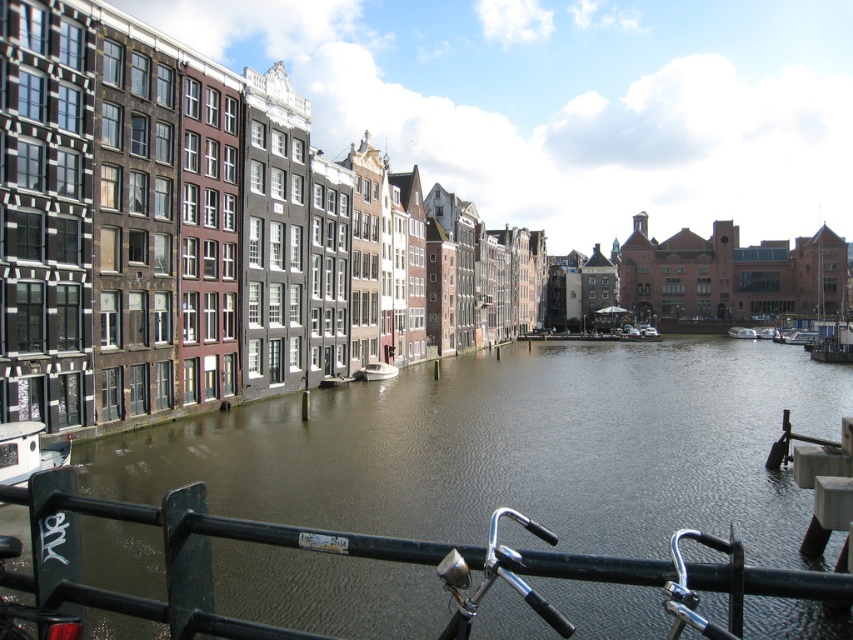
Which of these two, brown water at center or white glossy boat at center, stands shorter?

With less height is white glossy boat at center.

Measure the distance between point (641, 392) and camera.

Point (641, 392) and camera are 335.68 feet apart.

Describe the element at coordinates (514, 448) in the screenshot. I see `brown water at center` at that location.

Locate an element on the screen. The height and width of the screenshot is (640, 853). brown water at center is located at coordinates (514, 448).

Between point (380, 372) and point (740, 332), which one is positioned behind?

The point (740, 332) is behind.

Based on the photo, does white glossy boat at center have a lesser height compared to white plastic boat at center?

Correct, white glossy boat at center is not as tall as white plastic boat at center.

Who is more distant from viewer, (396, 371) or (735, 326)?

Point (735, 326)

Locate an element on the screen. white glossy boat at center is located at coordinates (378, 371).

Does brown water at center have a greater height compared to white plastic boat at center?

Indeed, brown water at center has a greater height compared to white plastic boat at center.

Looking at this image, is brown water at center wider than white plastic boat at center?

Yes.

Identify the location of brown water at center. (514, 448).

The height and width of the screenshot is (640, 853). I want to click on brown water at center, so click(514, 448).